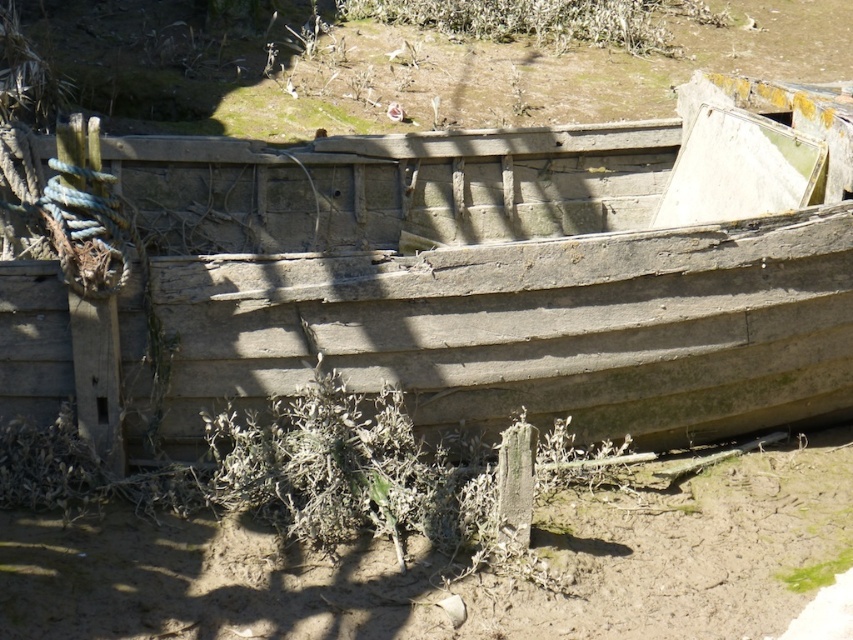
Question: Is brown sandy soil at lower center behind green leafy plant at upper center?

Choices:
 (A) yes
 (B) no

Answer: (B)

Question: Among these objects, which one is farthest from the camera?

Choices:
 (A) weathered wood boat at center
 (B) brown sandy soil at lower center
 (C) green leafy plant at upper center

Answer: (C)

Question: Is weathered wood boat at center thinner than green leafy plant at upper center?

Choices:
 (A) yes
 (B) no

Answer: (B)

Question: Is weathered wood boat at center bigger than brown sandy soil at lower center?

Choices:
 (A) no
 (B) yes

Answer: (B)

Question: Which point is farther to the camera?

Choices:
 (A) green leafy plant at upper center
 (B) brown sandy soil at lower center

Answer: (A)

Question: Which point is closer to the camera?

Choices:
 (A) weathered wood boat at center
 (B) green leafy plant at upper center
 (C) brown sandy soil at lower center

Answer: (C)